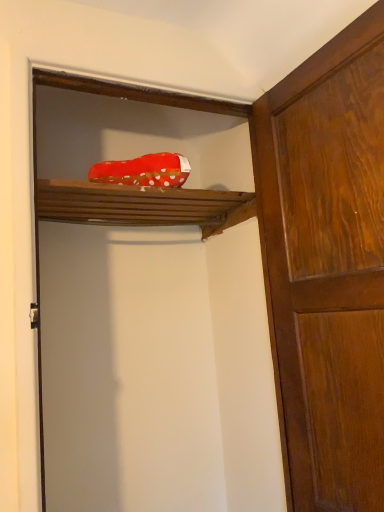
Identify the location of red polka dot fabric at upper center. (143, 170).

Locate an element on the screen. The width and height of the screenshot is (384, 512). red polka dot fabric at upper center is located at coordinates (143, 170).

How different are the orientations of wooden door at right, positioned as the 1th door in right-to-left order, and red polka dot fabric at center in degrees?

They differ by 90.8 degrees in their facing directions.

Between wooden door at right, the 2th door viewed from the left, and red polka dot fabric at center, which one appears on the right side from the viewer's perspective?

wooden door at right, the 2th door viewed from the left, is more to the right.

From a real-world perspective, which is physically above, wooden door at right, the 2th door viewed from the left, or red polka dot fabric at center?

red polka dot fabric at center, from a real-world perspective.

Between wooden door at right, positioned as the 1th door in right-to-left order, and red polka dot fabric at center, which one has larger size?

wooden door at right, positioned as the 1th door in right-to-left order, is bigger.

In the scene shown: Between wooden door at upper center, the 2th door from the right, and wooden door at right, positioned as the 1th door in right-to-left order, which one has larger width?

With larger width is wooden door at upper center, the 2th door from the right.

Locate an element on the screen. door behind the wooden door at right, positioned as the 1th door in right-to-left order is located at coordinates (152, 310).

From a real-world perspective, does wooden door at upper center, which appears as the 1th door when viewed from the left, sit lower than wooden door at right, the 2th door viewed from the left?

No.

Is point (149, 161) closer to viewer compared to point (114, 193)?

Yes.

From the picture: Which of these two, red polka dot fabric at upper center or wooden door at upper center, which appears as the 1th door when viewed from the left, is thinner?

wooden door at upper center, which appears as the 1th door when viewed from the left.

From the image's perspective, would you say red polka dot fabric at upper center is positioned over wooden door at upper center, the 2th door from the right?

Correct, red polka dot fabric at upper center appears higher than wooden door at upper center, the 2th door from the right, in the image.

From a real-world perspective, is red polka dot fabric at center physically above wooden door at upper center, the 2th door from the right?

Yes, from a real-world perspective, red polka dot fabric at center is over wooden door at upper center, the 2th door from the right

Is red polka dot fabric at center at the left side of wooden door at upper center, which appears as the 1th door when viewed from the left?

Indeed, red polka dot fabric at center is positioned on the left side of wooden door at upper center, which appears as the 1th door when viewed from the left.

Is the depth of red polka dot fabric at center less than that of wooden door at upper center, the 2th door from the right?

No, red polka dot fabric at center is further to the viewer.

Considering the relative sizes of red polka dot fabric at center and wooden door at upper center, the 2th door from the right, in the image provided, is red polka dot fabric at center wider than wooden door at upper center, the 2th door from the right,?

Yes, red polka dot fabric at center is wider than wooden door at upper center, the 2th door from the right.

Is red polka dot fabric at center next to red polka dot fabric at upper center?

No, red polka dot fabric at center is not beside red polka dot fabric at upper center.

From the image's perspective, is red polka dot fabric at center located beneath red polka dot fabric at upper center?

Yes, from the image's perspective, red polka dot fabric at center is beneath red polka dot fabric at upper center.

Is wooden door at right, positioned as the 1th door in right-to-left order, inside or outside of wooden door at upper center, the 2th door from the right?

wooden door at right, positioned as the 1th door in right-to-left order, is spatially situated outside wooden door at upper center, the 2th door from the right.

Which object is closer to the camera, wooden door at right, the 2th door viewed from the left, or wooden door at upper center, the 2th door from the right?

wooden door at right, the 2th door viewed from the left, is closer to the camera.

Is wooden door at right, positioned as the 1th door in right-to-left order, positioned with its back to wooden door at upper center, which appears as the 1th door when viewed from the left?

wooden door at right, positioned as the 1th door in right-to-left order, is not turned away from wooden door at upper center, which appears as the 1th door when viewed from the left.

Is wooden door at right, the 2th door viewed from the left, to the left of wooden door at upper center, the 2th door from the right, from the viewer's perspective?

No, wooden door at right, the 2th door viewed from the left, is not to the left of wooden door at upper center, the 2th door from the right.

From the picture: Between red polka dot fabric at center and wooden door at right, the 2th door viewed from the left, which one appears on the right side from the viewer's perspective?

Positioned to the right is wooden door at right, the 2th door viewed from the left.

In terms of height, does red polka dot fabric at center look taller or shorter compared to wooden door at right, positioned as the 1th door in right-to-left order?

Considering their sizes, red polka dot fabric at center has less height than wooden door at right, positioned as the 1th door in right-to-left order.

From the image's perspective, which object appears higher, red polka dot fabric at center or wooden door at right, the 2th door viewed from the left?

From the image's view, red polka dot fabric at center is above.

Is red polka dot fabric at center inside or outside of wooden door at right, positioned as the 1th door in right-to-left order?

red polka dot fabric at center lies outside wooden door at right, positioned as the 1th door in right-to-left order.

At what (x,y) coordinates should I click in order to perform the action: click on shelf on the left of wooden door at right, positioned as the 1th door in right-to-left order. Please return your answer as a coordinate pair (x, y). Looking at the image, I should click on (142, 205).

I want to click on door on the right of the wooden door at upper center, which appears as the 1th door when viewed from the left, so click(327, 265).

Considering their positions, is wooden door at upper center, which appears as the 1th door when viewed from the left, positioned further to red polka dot fabric at upper center than wooden door at right, positioned as the 1th door in right-to-left order?

Among the two, wooden door at right, positioned as the 1th door in right-to-left order, is located further to red polka dot fabric at upper center.

Estimate the real-world distances between objects in this image. Which object is closer to wooden door at right, the 2th door viewed from the left, red polka dot fabric at upper center or wooden door at upper center, the 2th door from the right?

wooden door at upper center, the 2th door from the right, lies closer to wooden door at right, the 2th door viewed from the left, than the other object.

Based on the photo, based on their spatial positions, is wooden door at upper center, which appears as the 1th door when viewed from the left, or wooden door at right, positioned as the 1th door in right-to-left order, closer to red polka dot fabric at center?

wooden door at upper center, which appears as the 1th door when viewed from the left, lies closer to red polka dot fabric at center than the other object.

In the scene shown: Looking at the image, which one is located further to wooden door at upper center, the 2th door from the right, red polka dot fabric at upper center or wooden door at right, the 2th door viewed from the left?

Among the two, red polka dot fabric at upper center is located further to wooden door at upper center, the 2th door from the right.

Based on their spatial positions, is wooden door at upper center, the 2th door from the right, or red polka dot fabric at upper center further from wooden door at right, the 2th door viewed from the left?

Among the two, red polka dot fabric at upper center is located further to wooden door at right, the 2th door viewed from the left.

Looking at the image, which one is located closer to red polka dot fabric at upper center, red polka dot fabric at center or wooden door at upper center, which appears as the 1th door when viewed from the left?

The object closer to red polka dot fabric at upper center is red polka dot fabric at center.

Based on their spatial positions, is wooden door at right, the 2th door viewed from the left, or red polka dot fabric at center further from red polka dot fabric at upper center?

Among the two, wooden door at right, the 2th door viewed from the left, is located further to red polka dot fabric at upper center.

From the image, which object appears to be farther from wooden door at right, positioned as the 1th door in right-to-left order, red polka dot fabric at center or red polka dot fabric at upper center?

The object further to wooden door at right, positioned as the 1th door in right-to-left order, is red polka dot fabric at upper center.

Identify the location of door between red polka dot fabric at center and wooden door at right, the 2th door viewed from the left, in the horizontal direction. This screenshot has width=384, height=512. (152, 310).

Find the location of a particular element. Image resolution: width=384 pixels, height=512 pixels. door between red polka dot fabric at upper center and wooden door at right, positioned as the 1th door in right-to-left order, in the horizontal direction is located at coordinates (152, 310).

Where is `shelf between red polka dot fabric at upper center and wooden door at upper center, which appears as the 1th door when viewed from the left, in the vertical direction`? shelf between red polka dot fabric at upper center and wooden door at upper center, which appears as the 1th door when viewed from the left, in the vertical direction is located at coordinates (142, 205).

At what (x,y) coordinates should I click in order to perform the action: click on material between red polka dot fabric at center and wooden door at right, positioned as the 1th door in right-to-left order, in the horizontal direction. Please return your answer as a coordinate pair (x, y). This screenshot has height=512, width=384. Looking at the image, I should click on (143, 170).